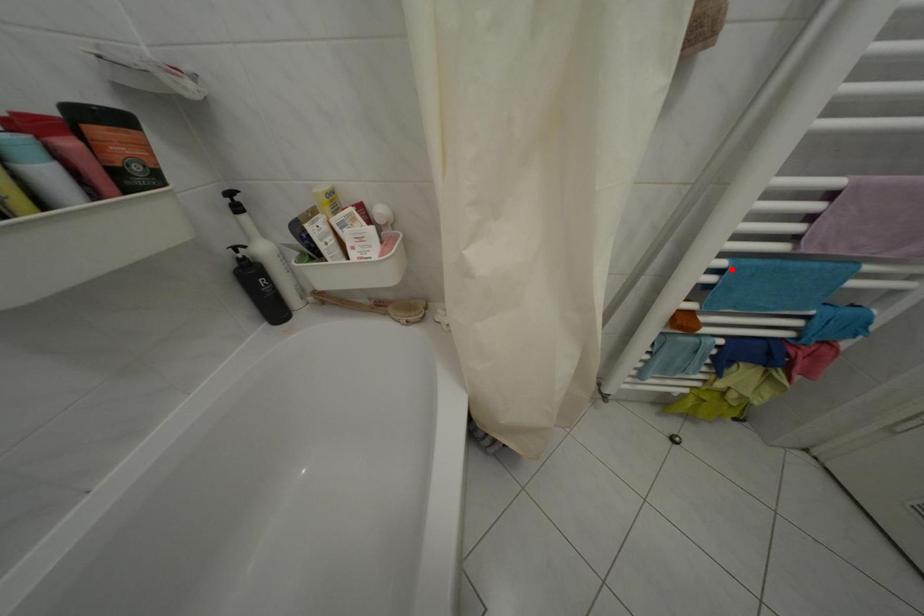
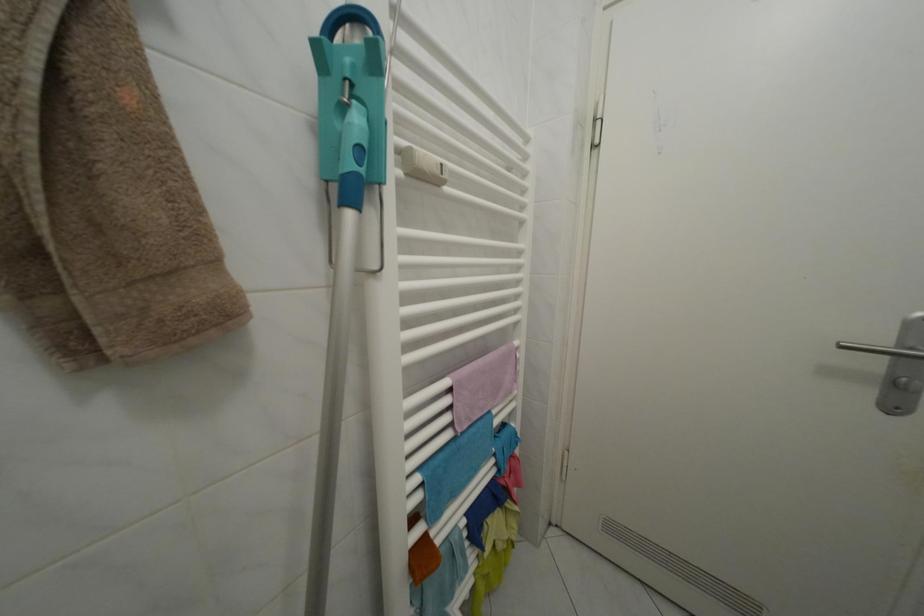
Find the pixel in the second image that matches the highlighted location in the first image.

(427, 485)